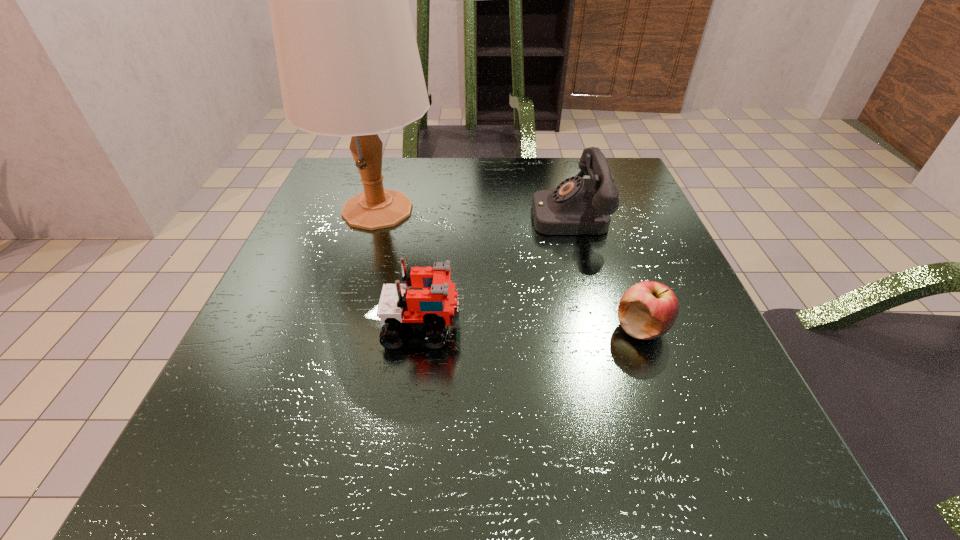
Identify the location of the tallest object. (348, 62).

In order to click on telephone in this screenshot , I will do `click(578, 206)`.

Locate an element on the screen. This screenshot has height=540, width=960. Lego is located at coordinates (436, 306).

The width and height of the screenshot is (960, 540). Identify the location of apple. click(x=647, y=310).

At what (x,y) coordinates should I click in order to perform the action: click on vacant position located 0.120m on the front of the table lamp. Please return your answer as a coordinate pair (x, y). Image resolution: width=960 pixels, height=540 pixels. Looking at the image, I should click on (352, 291).

I want to click on vacant region located on the dial of the telephone, so click(456, 213).

The height and width of the screenshot is (540, 960). I want to click on vacant space located 0.140m on the dial of the telephone, so click(x=466, y=213).

Where is `free region located 0.330m on the dial of the telephone`? free region located 0.330m on the dial of the telephone is located at coordinates (375, 213).

The width and height of the screenshot is (960, 540). I want to click on free space located 0.180m on the front-facing side of the Lego, so click(574, 326).

I want to click on vacant space situated on the back of the shortest object, so click(x=589, y=184).